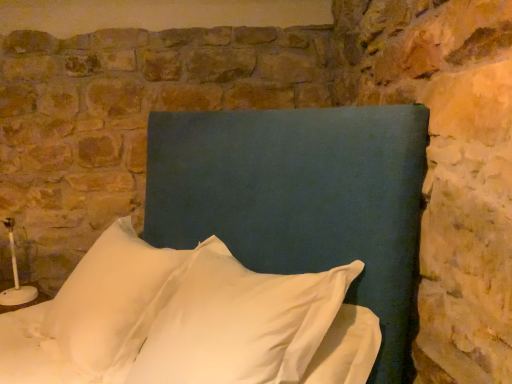
Question: Is white soft pillow at center, acting as the 1th pillow starting from the left, bigger than white fabric pillow at center, which is the first pillow in right-to-left order?

Choices:
 (A) no
 (B) yes

Answer: (B)

Question: Is white soft pillow at center, positioned as the 2th pillow in right-to-left order, facing towards white fabric pillow at center, which is the first pillow in right-to-left order?

Choices:
 (A) no
 (B) yes

Answer: (A)

Question: Is white soft pillow at center, acting as the 1th pillow starting from the left, facing away from white fabric pillow at center, which is the first pillow in right-to-left order?

Choices:
 (A) no
 (B) yes

Answer: (A)

Question: Is white soft pillow at center, positioned as the 2th pillow in right-to-left order, at the right side of white fabric pillow at center, which is the first pillow in right-to-left order?

Choices:
 (A) yes
 (B) no

Answer: (B)

Question: From the image's perspective, does white soft pillow at center, positioned as the 2th pillow in right-to-left order, appear higher than white fabric pillow at center, the second pillow in the left-to-right sequence?

Choices:
 (A) no
 (B) yes

Answer: (B)

Question: Based on their sizes in the image, would you say white soft pillow at center, positioned as the 2th pillow in right-to-left order, is bigger or smaller than matte blue headboard at center?

Choices:
 (A) small
 (B) big

Answer: (A)

Question: Which is correct: white soft pillow at center, positioned as the 2th pillow in right-to-left order, is inside matte blue headboard at center, or outside of it?

Choices:
 (A) outside
 (B) inside

Answer: (A)

Question: Would you say white soft pillow at center, acting as the 1th pillow starting from the left, is to the left or to the right of matte blue headboard at center in the picture?

Choices:
 (A) left
 (B) right

Answer: (A)

Question: Relative to matte blue headboard at center, is white soft pillow at center, acting as the 1th pillow starting from the left, in front or behind?

Choices:
 (A) behind
 (B) front

Answer: (A)

Question: From the image's perspective, is white fabric pillow at center, the second pillow in the left-to-right sequence, above or below matte blue headboard at center?

Choices:
 (A) below
 (B) above

Answer: (A)

Question: Considering the positions of white fabric pillow at center, which is the first pillow in right-to-left order, and matte blue headboard at center in the image, is white fabric pillow at center, which is the first pillow in right-to-left order, bigger or smaller than matte blue headboard at center?

Choices:
 (A) small
 (B) big

Answer: (A)

Question: From a real-world perspective, is white fabric pillow at center, which is the first pillow in right-to-left order, physically located above or below matte blue headboard at center?

Choices:
 (A) above
 (B) below

Answer: (B)

Question: Considering the positions of white fabric pillow at center, the second pillow in the left-to-right sequence, and matte blue headboard at center in the image, is white fabric pillow at center, the second pillow in the left-to-right sequence, taller or shorter than matte blue headboard at center?

Choices:
 (A) tall
 (B) short

Answer: (B)

Question: From a real-world perspective, is matte blue headboard at center above or below white fabric pillow at center, the second pillow in the left-to-right sequence?

Choices:
 (A) below
 (B) above

Answer: (B)

Question: Is matte blue headboard at center spatially inside white fabric pillow at center, which is the first pillow in right-to-left order, or outside of it?

Choices:
 (A) inside
 (B) outside

Answer: (A)